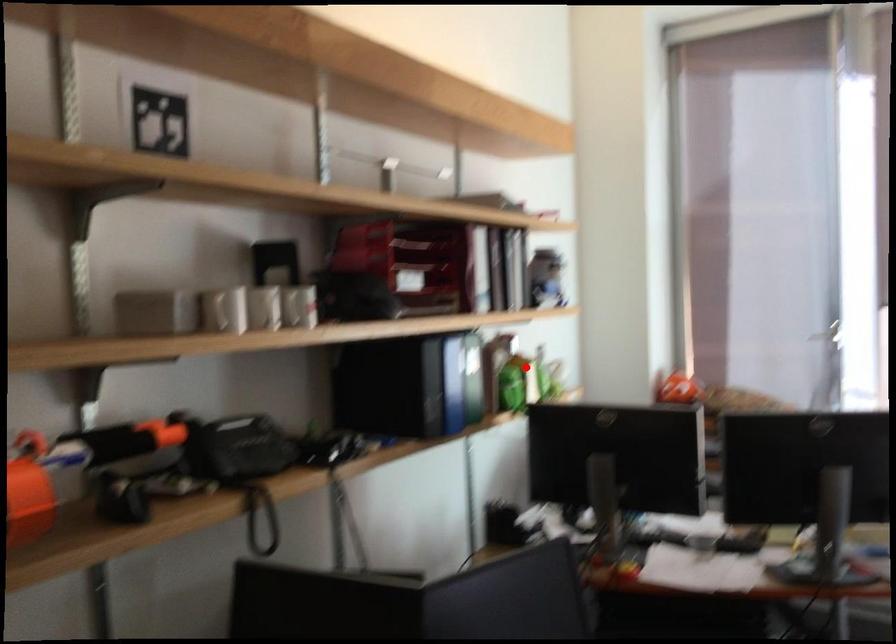
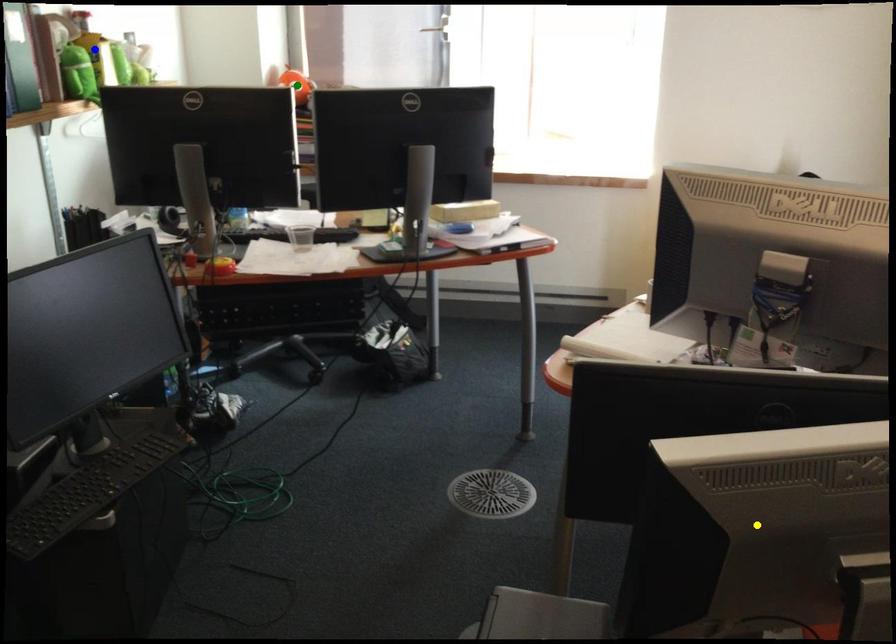
Question: I am providing you with two images of the same scene from different viewpoints. A red point is marked on the first image. You are given multiple points on the second image. In image 2, which mark is for the same physical point as the one in image 1?

Choices:
 (A) blue point
 (B) yellow point
 (C) green point

Answer: (A)